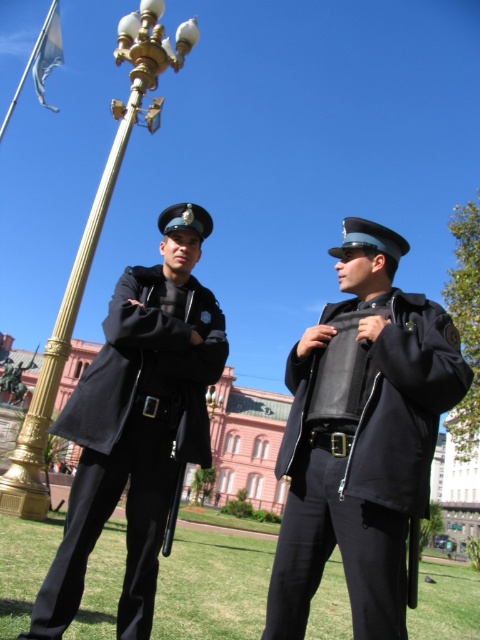
Can you confirm if matte black uniform at center is shorter than black leather jacket at center?

In fact, matte black uniform at center may be taller than black leather jacket at center.

In order to click on matte black uniform at center in this screenshot , I will do `click(361, 440)`.

From the picture: Can you confirm if black leather jacket at center is shorter than black matte uniform at left?

In fact, black leather jacket at center may be taller than black matte uniform at left.

Where is `black leather jacket at center`? black leather jacket at center is located at coordinates (360, 454).

Can you confirm if matte black uniform at center is bigger than gold polished metal lamp post at upper left?

No.

Which is behind, point (132, 268) or point (68, 284)?

Point (68, 284)

Locate an element on the screen. Image resolution: width=480 pixels, height=640 pixels. matte black uniform at center is located at coordinates (361, 440).